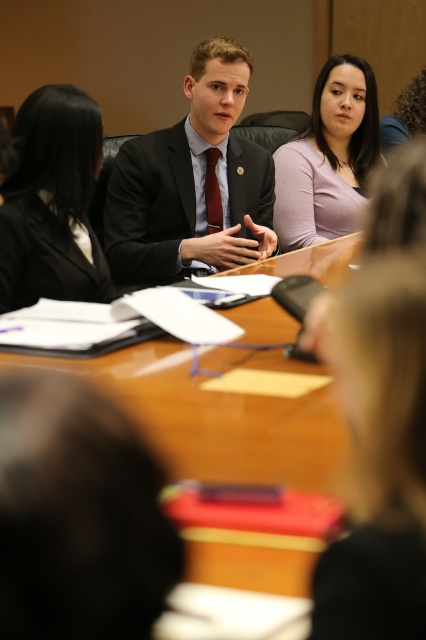
Question: Can you confirm if blonde hair at lower right is bigger than black suit at left?

Choices:
 (A) no
 (B) yes

Answer: (A)

Question: Which point is closer to the camera?

Choices:
 (A) (319, 116)
 (B) (192, 144)
 (C) (37, 237)
 (D) (371, 436)

Answer: (D)

Question: Can you confirm if blonde hair at lower right is bigger than black suit at left?

Choices:
 (A) no
 (B) yes

Answer: (A)

Question: Among these points, which one is farthest from the camera?

Choices:
 (A) click(x=115, y=243)
 (B) click(x=373, y=332)
 (C) click(x=11, y=252)

Answer: (A)

Question: Which object is closer to the camera taking this photo?

Choices:
 (A) blonde hair at lower right
 (B) matte black suit at center
 (C) matte purple shirt at center

Answer: (A)

Question: Is matte black suit at center to the left of black suit at left from the viewer's perspective?

Choices:
 (A) yes
 (B) no

Answer: (B)